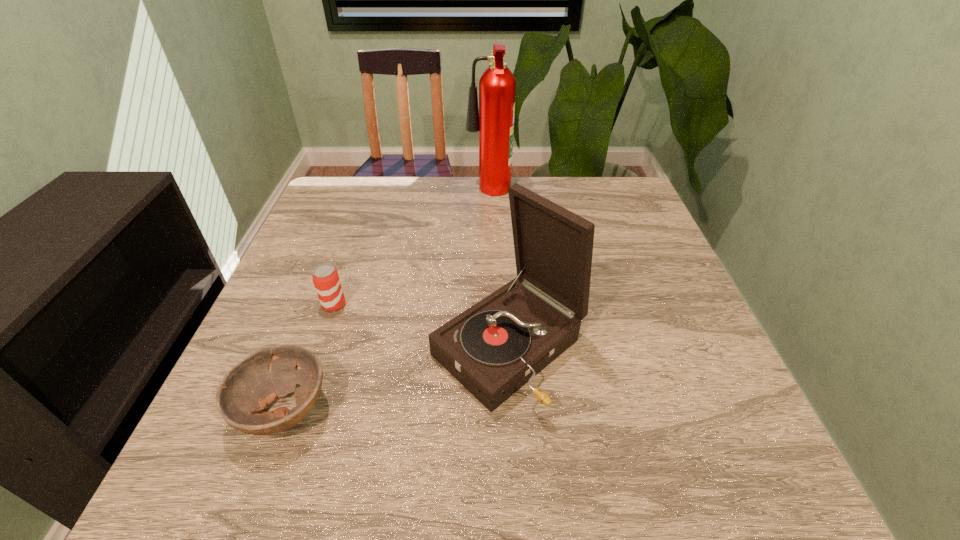
Find the location of a particular element. free location at the far left corner of the desktop is located at coordinates (336, 218).

Locate an element on the screen. vacant space at the near right corner is located at coordinates (779, 481).

At what (x,y) coordinates should I click in order to perform the action: click on free space that is in between the fire extinguisher and the phonograph record. Please return your answer as a coordinate pair (x, y). This screenshot has width=960, height=540. Looking at the image, I should click on (498, 271).

Find the location of a particular element. Image resolution: width=960 pixels, height=540 pixels. free area in between the phonograph record and the shortest object is located at coordinates (396, 380).

At what (x,y) coordinates should I click in order to perform the action: click on vacant space that's between the shortest object and the tallest object. Please return your answer as a coordinate pair (x, y). The width and height of the screenshot is (960, 540). Looking at the image, I should click on tap(386, 301).

In order to click on empty space that is in between the beer can and the farthest object in this screenshot , I will do click(x=412, y=249).

Find the location of a particular element. Image resolution: width=960 pixels, height=540 pixels. free space that is in between the tallest object and the beer can is located at coordinates (412, 249).

Identify the location of empty space that is in between the tallest object and the second shortest object. The height and width of the screenshot is (540, 960). (412, 249).

Find the location of a particular element. free point between the bowl and the tallest object is located at coordinates (386, 301).

Find the location of a particular element. This screenshot has width=960, height=540. vacant area that lies between the phonograph record and the shortest object is located at coordinates (396, 380).